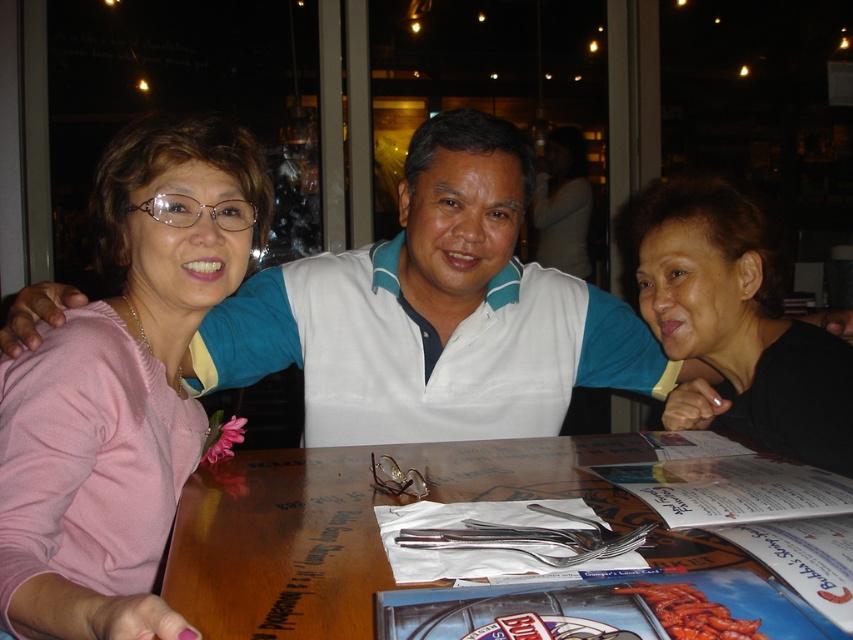
Can you confirm if white smooth shirt at center is positioned above pink sweater at left?

Yes, white smooth shirt at center is above pink sweater at left.

Does point (618, 317) lie behind point (161, 544)?

Yes, it is.

At what (x,y) coordinates should I click in order to perform the action: click on white smooth shirt at center. Please return your answer as a coordinate pair (x, y). Looking at the image, I should click on (434, 314).

Is white smooth shirt at center further to camera compared to black matte hair at upper right?

Yes, it is behind black matte hair at upper right.

In the scene shown: Does white smooth shirt at center have a greater height compared to black matte hair at upper right?

Correct, white smooth shirt at center is much taller as black matte hair at upper right.

Between point (316, 442) and point (709, 246), which one is positioned behind?

The point (316, 442) is behind.

Where is `white smooth shirt at center`? Image resolution: width=853 pixels, height=640 pixels. white smooth shirt at center is located at coordinates (434, 314).

Which is above, wooden table at center or black matte hair at upper right?

black matte hair at upper right is above.

Who is more forward, (444, 497) or (769, 422)?

Point (444, 497)

This screenshot has height=640, width=853. Identify the location of wooden table at center. (373, 525).